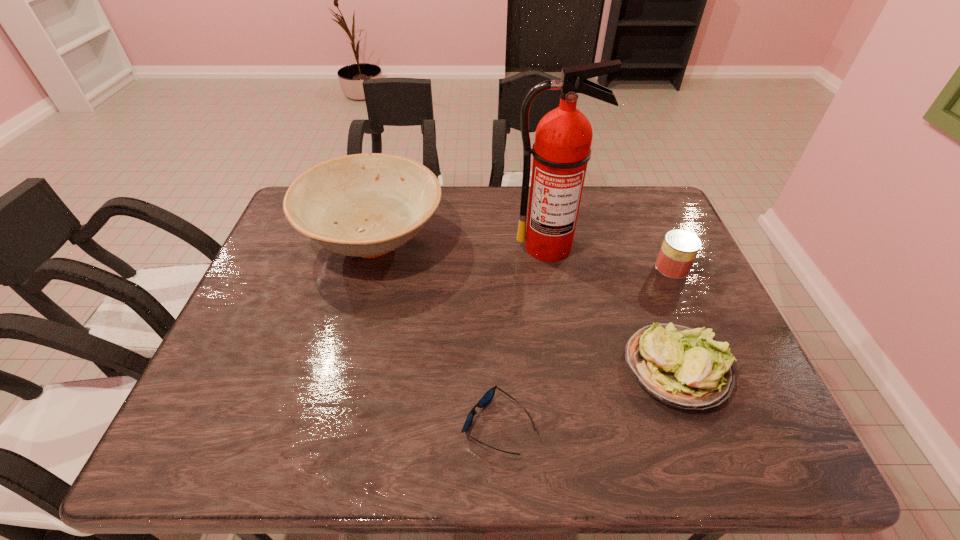
Where is `vacant space that satisfies the following two spatial constraints: 1. on the front side of the second tallest object; 2. on the left side of the can`? The width and height of the screenshot is (960, 540). vacant space that satisfies the following two spatial constraints: 1. on the front side of the second tallest object; 2. on the left side of the can is located at coordinates (367, 267).

In order to click on vacant space that satisfies the following two spatial constraints: 1. on the side of the fire extinguisher near the handle; 2. at the front of the sunglasses showing the lenses in this screenshot , I will do `click(579, 425)`.